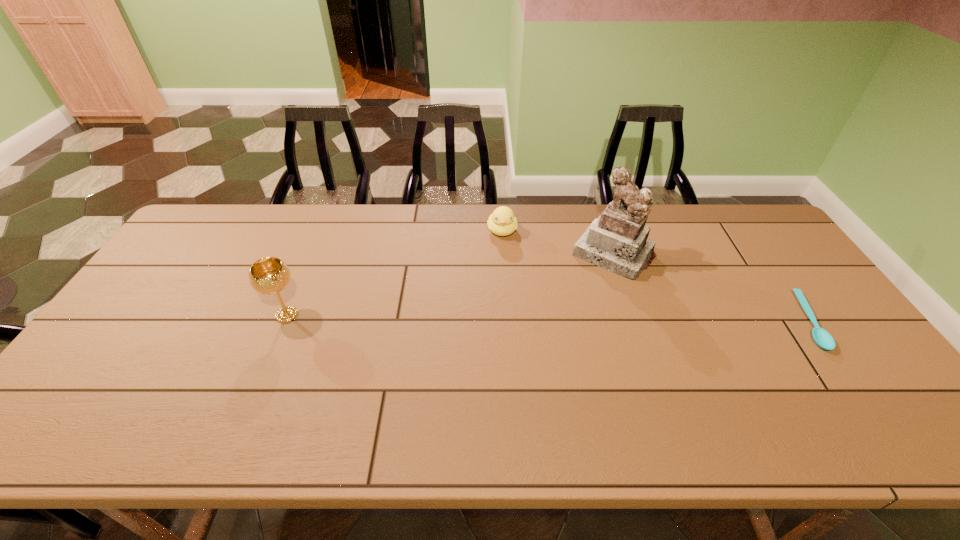
The height and width of the screenshot is (540, 960). I want to click on the third shortest object, so click(270, 275).

At what (x,y) coordinates should I click in order to perform the action: click on chalice. Please return your answer as a coordinate pair (x, y). Looking at the image, I should click on (270, 275).

You are a GUI agent. You are given a task and a screenshot of the screen. Output one action in this format:
    pyautogui.click(x=<x>, y=<y>)
    Task: Click on the shortest object
    
    Given the screenshot: What is the action you would take?
    pyautogui.click(x=823, y=339)

Where is `the rightmost object`? This screenshot has height=540, width=960. the rightmost object is located at coordinates (823, 339).

This screenshot has height=540, width=960. In order to click on the tallest object in this screenshot , I will do `click(617, 241)`.

You are a GUI agent. You are given a task and a screenshot of the screen. Output one action in this format:
    pyautogui.click(x=<x>, y=<y>)
    Task: Click on the third object from left to right
    The width and height of the screenshot is (960, 540).
    Given the screenshot: What is the action you would take?
    pyautogui.click(x=617, y=241)

The width and height of the screenshot is (960, 540). What are the coordinates of `the third tallest object` in the screenshot? It's located at (501, 222).

Identify the location of the second object from left to right. Image resolution: width=960 pixels, height=540 pixels. (501, 222).

This screenshot has width=960, height=540. I want to click on vacant space located 0.330m on the right of the second tallest object, so click(x=424, y=315).

You are a GUI agent. You are given a task and a screenshot of the screen. Output one action in this format:
    pyautogui.click(x=<x>, y=<y>)
    Task: Click on the free space located on the left of the rightmost object
    
    Given the screenshot: What is the action you would take?
    pyautogui.click(x=779, y=321)